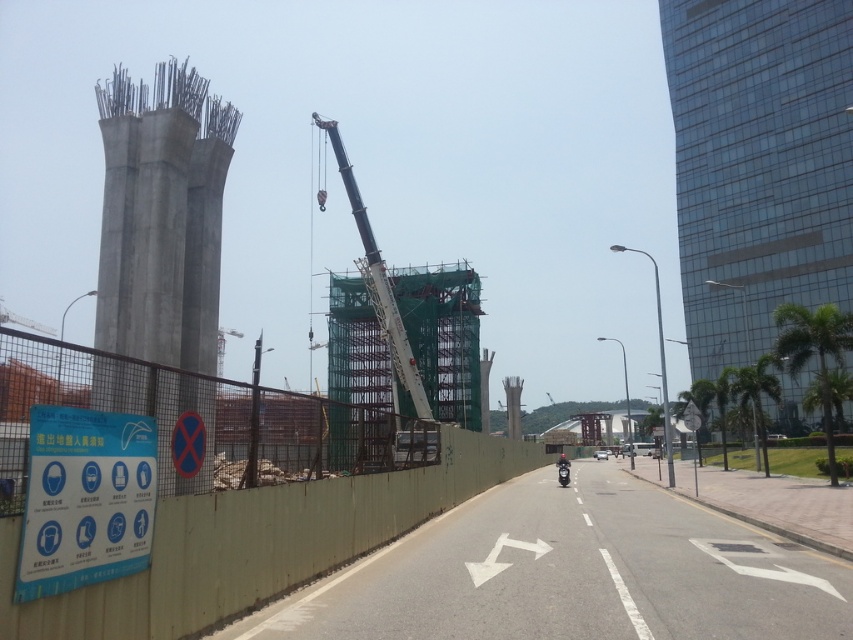
Question: Which point is farther to the camera?

Choices:
 (A) shiny black motorcycle at center
 (B) concrete pillar at left
 (C) glassy glass skyscraper at right

Answer: (C)

Question: Is concrete pillar at left thinner than blue paper sign at lower left?

Choices:
 (A) yes
 (B) no

Answer: (B)

Question: Which of the following is the closest to the observer?

Choices:
 (A) (74, 528)
 (B) (199, 628)
 (C) (125, 284)

Answer: (A)

Question: Does blue paper sign at lower left appear under shiny black motorcycle at center?

Choices:
 (A) no
 (B) yes

Answer: (A)

Question: Which object is positioned closest to the green concrete fence at left?

Choices:
 (A) blue paper sign at lower left
 (B) glassy glass skyscraper at right
 (C) shiny black motorcycle at center
 (D) concrete pillar at left

Answer: (A)

Question: Is concrete pillar at left behind shiny black motorcycle at center?

Choices:
 (A) yes
 (B) no

Answer: (B)